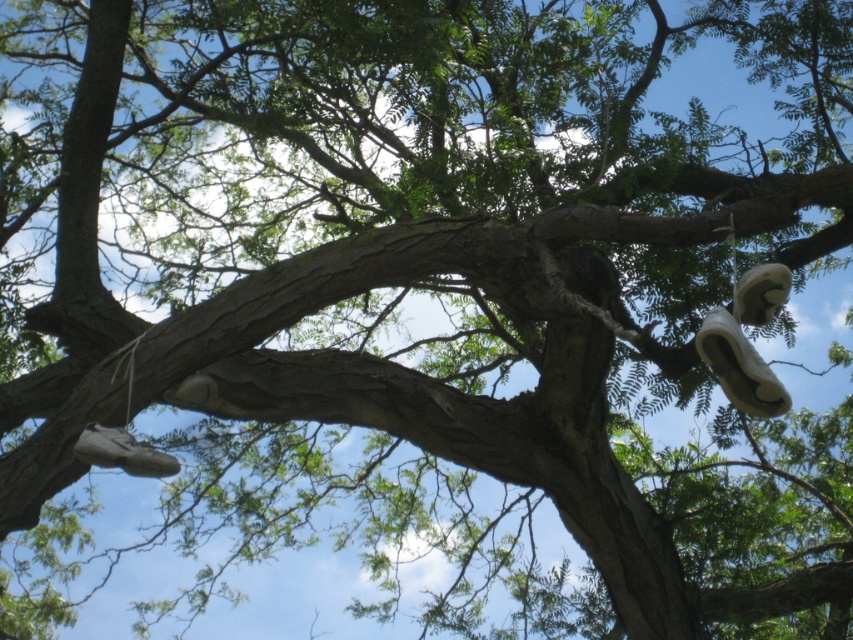
Who is positioned more to the right, white matte shoe at lower left or white suede shoe at upper right?

Positioned to the right is white suede shoe at upper right.

Which is behind, point (149, 452) or point (749, 289)?

The point (149, 452) is behind.

Locate an element on the screen. The width and height of the screenshot is (853, 640). white matte shoe at lower left is located at coordinates (122, 452).

In order to click on white matte shoe at lower left in this screenshot , I will do `click(122, 452)`.

Is white matte shoe at upper right to the left of white suede shoe at upper right from the viewer's perspective?

Indeed, white matte shoe at upper right is positioned on the left side of white suede shoe at upper right.

Which is above, white matte shoe at upper right or white suede shoe at upper right?

white suede shoe at upper right is higher up.

Is point (703, 320) in front of point (756, 275)?

No, it is not.

The width and height of the screenshot is (853, 640). What are the coordinates of `white matte shoe at upper right` in the screenshot? It's located at (740, 365).

Is white matte shoe at upper right to the left of white matte shoe at lower left from the viewer's perspective?

No, white matte shoe at upper right is not to the left of white matte shoe at lower left.

Between point (724, 348) and point (123, 428), which one is positioned in front?

Point (724, 348) is more forward.

Which is in front, point (733, 336) or point (131, 449)?

Point (733, 336)

This screenshot has width=853, height=640. Find the location of `white matte shoe at upper right`. white matte shoe at upper right is located at coordinates (740, 365).